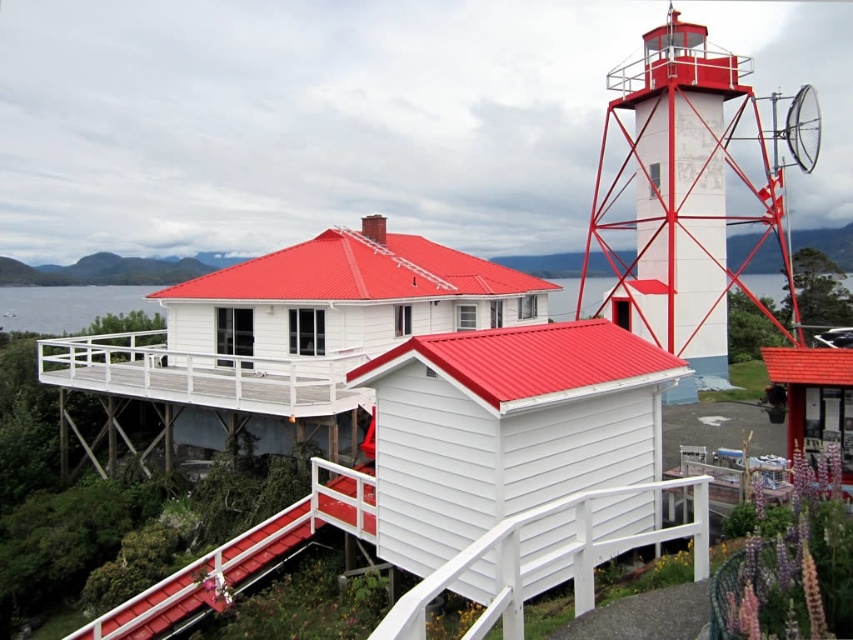
You are standing at the entrance of the lighthouse complex and want to reach the smooth wood handrail at center. Which direction should you walk to get there?

The smooth wood handrail at center is located at point 0.872 on the x axis and 0.286 on the y axis. Since you are at the entrance, you should walk towards the center of the image to reach it.

You are standing at the base of the lighthouse and want to take a photo of both the satellite dish and the red staircase. Which point, point (311,481) or point (6,324), is closer to your position?

Point (311,481) is closer to the camera, so it is closer to your position at the base of the lighthouse.